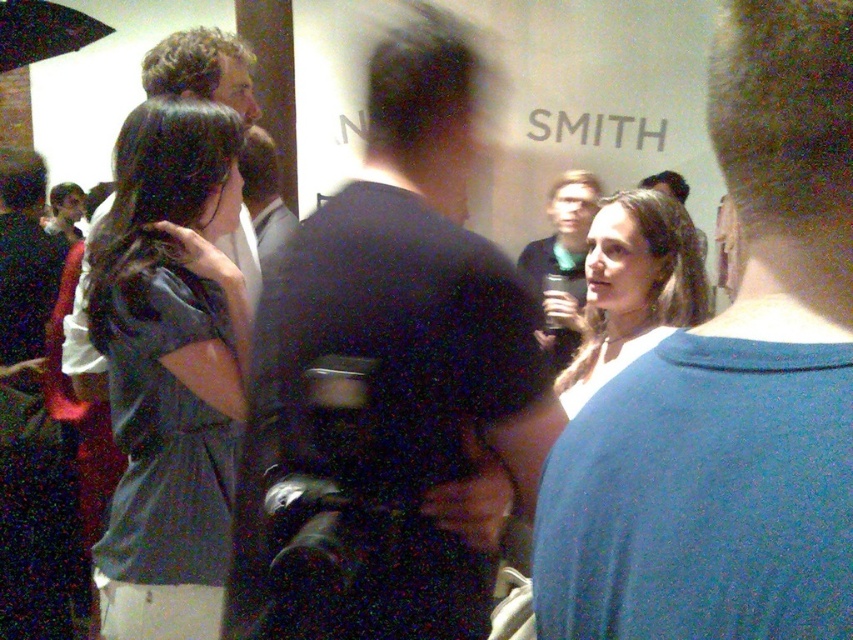
You are standing at the point marked as point (787,54) in the image. If you want to reach a friend who is 1 meter away from you in a straight line, will you be able to reach them without moving more than 1.5 meters?

The distance between you and the point (787,54) is 39.16 centimeters. Since your friend is 1 meter away from you, the total distance you need to move is 1 meter plus 39.16 centimeters, which is approximately 1.39 meters. This is within the 1.5 meters limit, so yes, you can reach them without moving more than 1.5 meters.